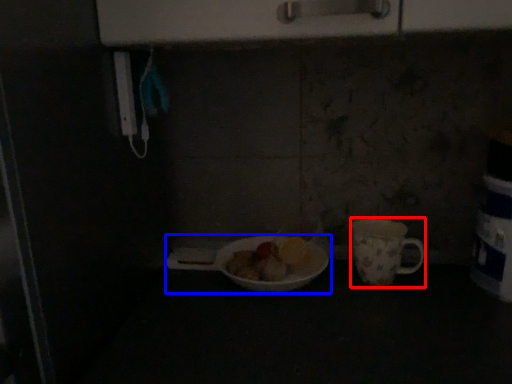
Question: Which object appears closest to the camera in this image, coffee cup (highlighted by a red box) or tableware (highlighted by a blue box)?

Choices:
 (A) coffee cup
 (B) tableware

Answer: (B)